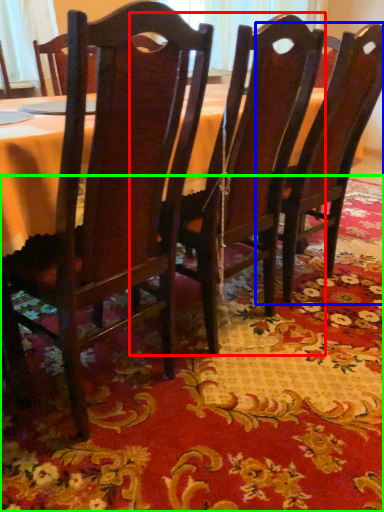
Question: Which object is positioned closest to chair (highlighted by a red box)? Select from chair (highlighted by a blue box) and place mat (highlighted by a green box).

Choices:
 (A) chair
 (B) place mat

Answer: (A)